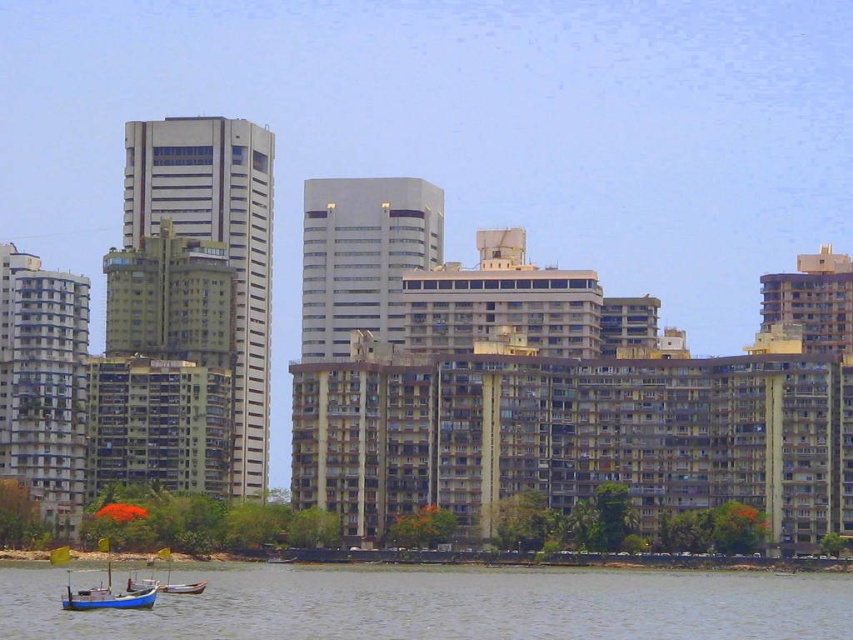
In the scene shown: Is greenish water at lower left smaller than blue wooden boat at lower left?

No, greenish water at lower left is not smaller than blue wooden boat at lower left.

Between point (407, 596) and point (103, 588), which one is positioned behind?

The point (103, 588) is more distant.

The width and height of the screenshot is (853, 640). Identify the location of greenish water at lower left. (445, 604).